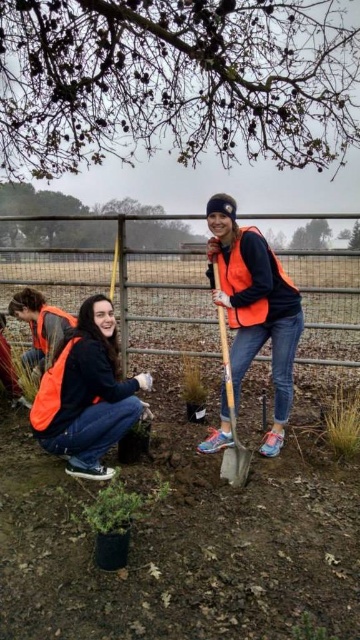
Question: Does orange reflective vest at center have a lesser width compared to matte black jacket at lower left?

Choices:
 (A) yes
 (B) no

Answer: (A)

Question: Can you confirm if orange reflective vest at center is wider than matte black jacket at lower left?

Choices:
 (A) yes
 (B) no

Answer: (B)

Question: Estimate the real-world distances between objects in this image. Which object is closer to the wooden shovel at center?

Choices:
 (A) smooth bark tree at upper center
 (B) matte black jacket at lower left
 (C) orange reflective vest at center

Answer: (C)

Question: Which of these objects is positioned closest to the wooden shovel at center?

Choices:
 (A) smooth bark tree at upper center
 (B) matte black jacket at lower left

Answer: (B)

Question: Which point is closer to the camera?

Choices:
 (A) (222, 468)
 (B) (279, 28)

Answer: (A)

Question: Does orange reflective vest at center appear over matte black jacket at lower left?

Choices:
 (A) yes
 (B) no

Answer: (A)